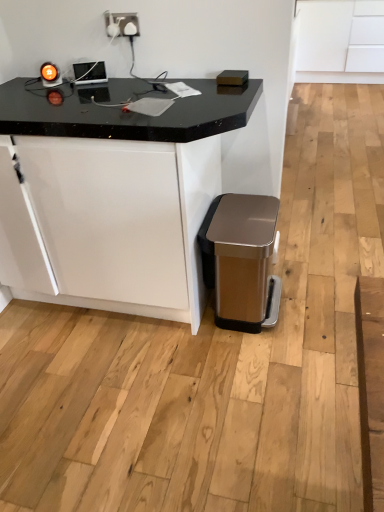
Question: From a real-world perspective, is white matte cabinet at upper right under black marble table at center?

Choices:
 (A) no
 (B) yes

Answer: (A)

Question: Does white matte cabinet at upper right appear on the right side of black marble table at center?

Choices:
 (A) yes
 (B) no

Answer: (A)

Question: From the image's perspective, is white matte cabinet at upper right located beneath black marble table at center?

Choices:
 (A) no
 (B) yes

Answer: (A)

Question: Does white matte cabinet at upper right have a lesser height compared to black marble table at center?

Choices:
 (A) no
 (B) yes

Answer: (B)

Question: Does white matte cabinet at upper right have a greater width compared to black marble table at center?

Choices:
 (A) no
 (B) yes

Answer: (B)

Question: Considering the relative sizes of white matte cabinet at upper right and black marble table at center in the image provided, is white matte cabinet at upper right bigger than black marble table at center?

Choices:
 (A) yes
 (B) no

Answer: (A)

Question: Does satin white socket at upper center turn towards black marble table at center?

Choices:
 (A) no
 (B) yes

Answer: (A)

Question: Can you see satin white socket at upper center touching black marble table at center?

Choices:
 (A) yes
 (B) no

Answer: (B)

Question: Considering the relative sizes of satin white socket at upper center and black marble table at center in the image provided, is satin white socket at upper center smaller than black marble table at center?

Choices:
 (A) yes
 (B) no

Answer: (A)

Question: Is the position of satin white socket at upper center more distant than that of black marble table at center?

Choices:
 (A) no
 (B) yes

Answer: (B)

Question: Can you confirm if satin white socket at upper center is taller than black marble table at center?

Choices:
 (A) no
 (B) yes

Answer: (A)

Question: Would you say satin white socket at upper center contains black marble table at center?

Choices:
 (A) no
 (B) yes

Answer: (A)

Question: Does satin gold plastic trash can at lower right have a greater height compared to black marble table at center?

Choices:
 (A) yes
 (B) no

Answer: (B)